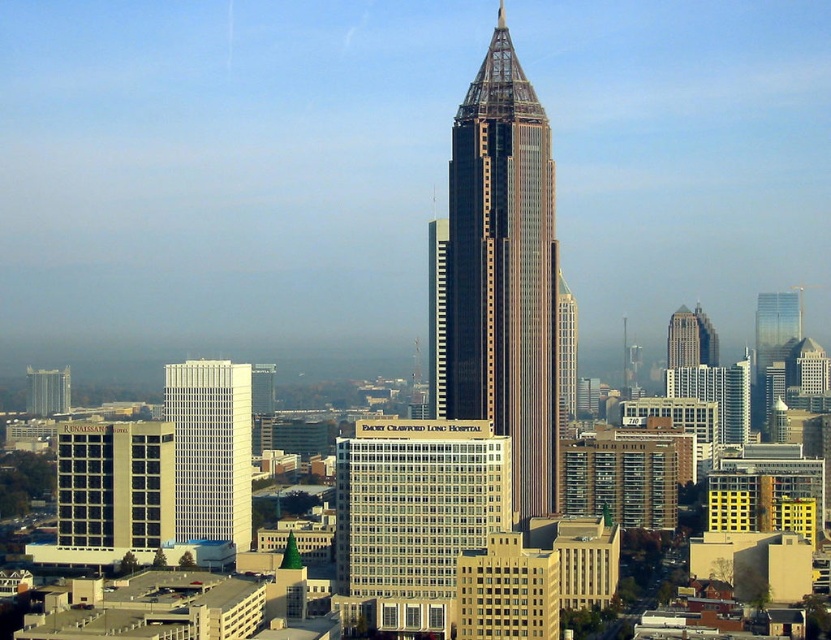
You are a drone operator tasked with flying a drone between the white glass building at center and the matte glass skyscraper at left. The drone has a maximum flight distance of 100 meters. Can the drone safely complete this flight without exceeding its range?

The white glass building at center and the matte glass skyscraper at left are 108.93 meters apart from each other. Since the drone has a maximum flight distance of 100 meters, it cannot safely complete the flight without exceeding its range.

You are standing at a viewpoint where you can see the cityscape described. There are two points marked in the image at coordinates point (529, 426) and point (187, 390). Which of these points is closer to your vantage point?

Point (529, 426) is in front of point (187, 390), so it is closer to your vantage point.